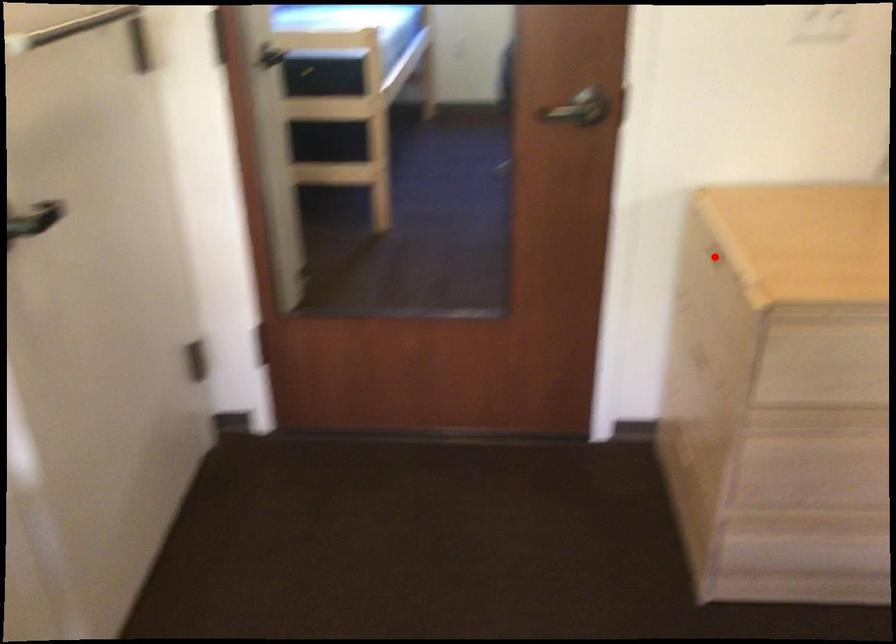
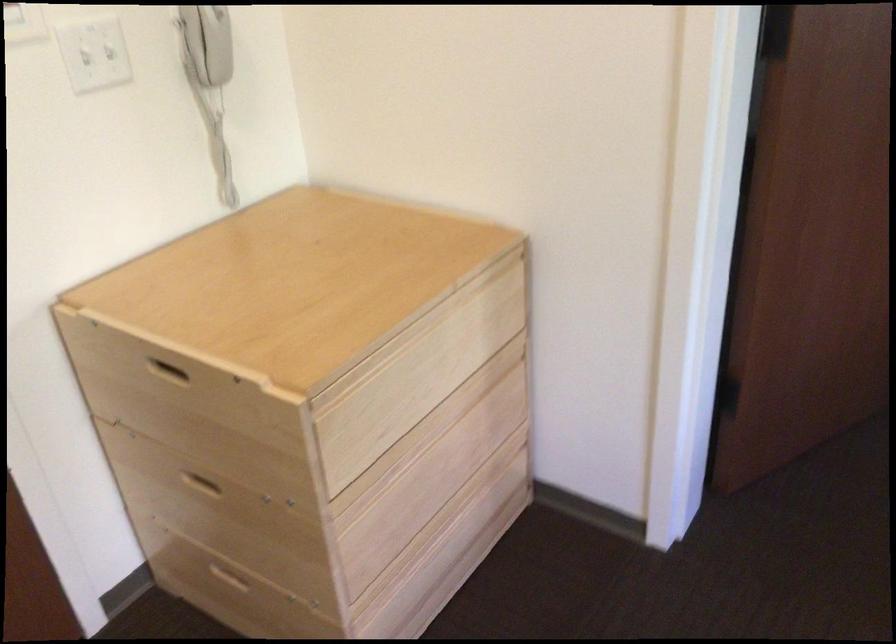
Question: I am providing you with two images of the same scene from different viewpoints. In image1, a red point is highlighted. Considering the same 3D point in image2, which of the following is correct?

Choices:
 (A) It is closer
 (B) It is farther

Answer: (A)